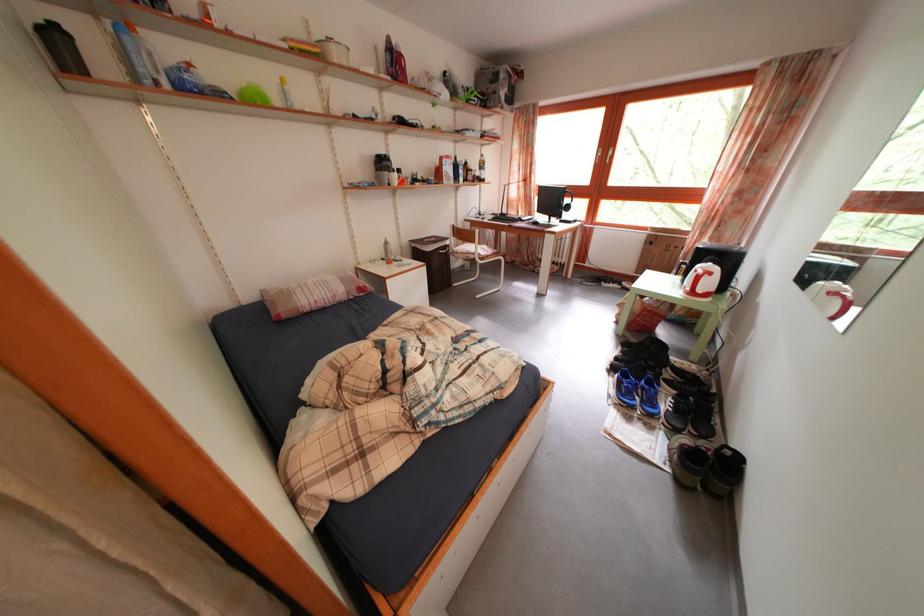
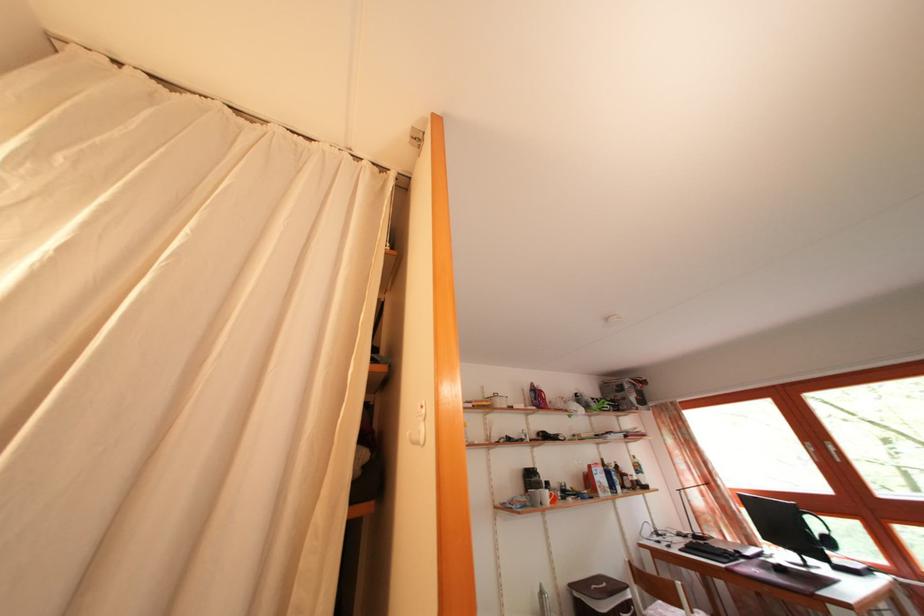
Find the pixel in the second image that matches (390,171) in the first image.

(538, 484)